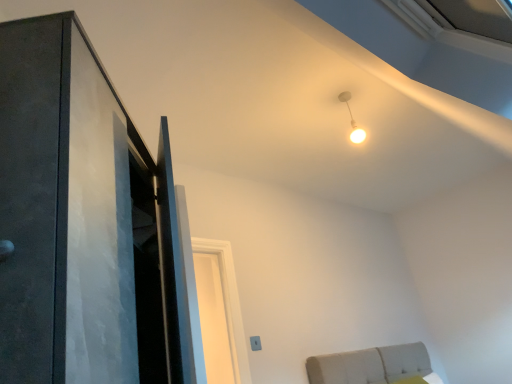
Question: From a real-world perspective, is matte black door at left physically located above or below white glossy light bulb at upper center?

Choices:
 (A) below
 (B) above

Answer: (A)

Question: From the image's perspective, is matte black door at left positioned above or below white glossy light bulb at upper center?

Choices:
 (A) below
 (B) above

Answer: (A)

Question: Considering the positions of point (86, 147) and point (355, 134), is point (86, 147) closer or farther from the camera than point (355, 134)?

Choices:
 (A) farther
 (B) closer

Answer: (B)

Question: From the image's perspective, is white glossy light bulb at upper center above or below matte black door at left?

Choices:
 (A) below
 (B) above

Answer: (B)

Question: Is white glossy light bulb at upper center to the left or to the right of matte black door at left in the image?

Choices:
 (A) right
 (B) left

Answer: (A)

Question: Would you say white glossy light bulb at upper center is inside or outside matte black door at left?

Choices:
 (A) inside
 (B) outside

Answer: (B)

Question: From a real-world perspective, is white glossy light bulb at upper center above or below matte black door at left?

Choices:
 (A) above
 (B) below

Answer: (A)